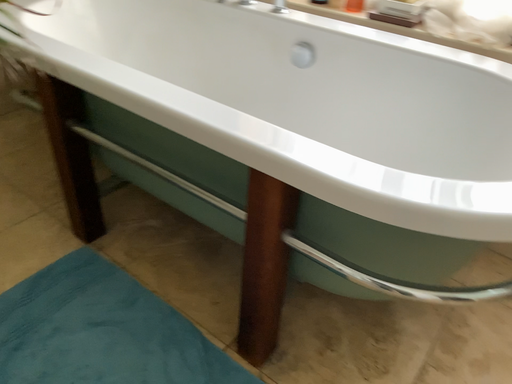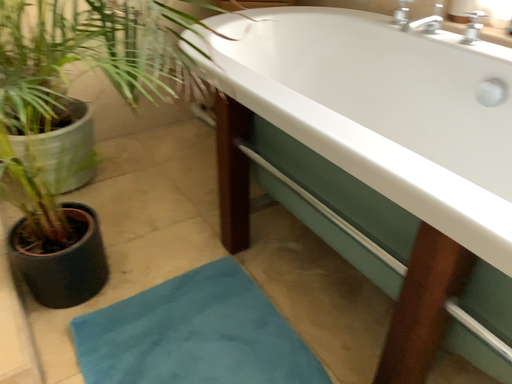
Question: How did the camera likely rotate when shooting the video?

Choices:
 (A) rotated left
 (B) rotated right

Answer: (A)